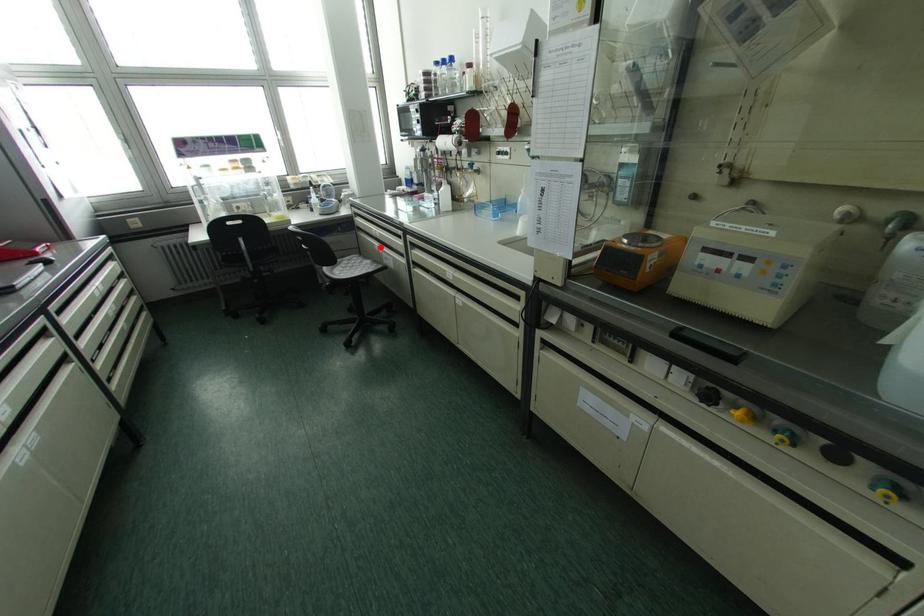
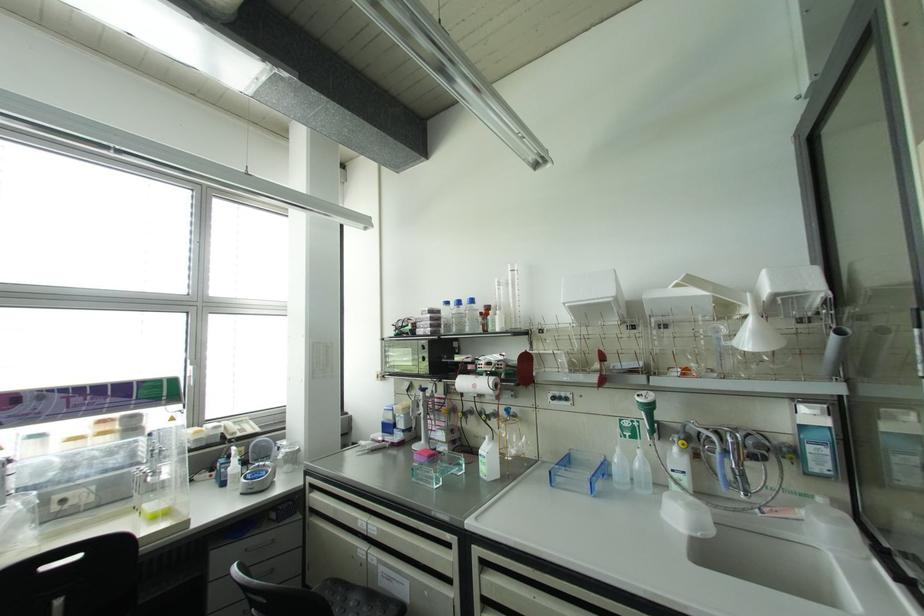
Question: I am providing you with two images of the same scene from different viewpoints. A red point is shown in image1. For the corresponding object point in image2, is it positioned nearer or farther from the camera?

Choices:
 (A) Nearer
 (B) Farther

Answer: (B)